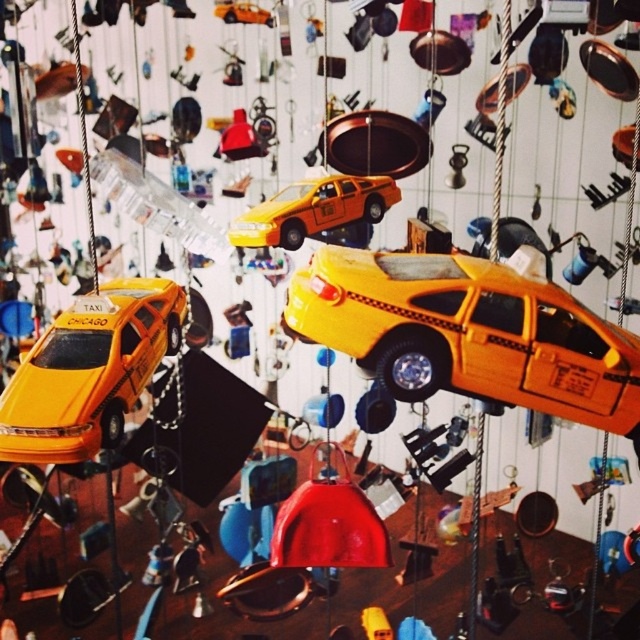
Question: Can you confirm if yellow matte taxi at center is smaller than matte yellow toy car at left?

Choices:
 (A) no
 (B) yes

Answer: (B)

Question: Can you confirm if matte yellow toy car at left is bigger than matte yellow toy car at center?

Choices:
 (A) yes
 (B) no

Answer: (A)

Question: Does yellow matte taxi at center have a larger size compared to matte yellow toy car at left?

Choices:
 (A) yes
 (B) no

Answer: (B)

Question: Which object is positioned closest to the matte yellow toy car at left?

Choices:
 (A) yellow matte taxi at center
 (B) matte yellow toy car at center

Answer: (B)

Question: Considering the real-world distances, which object is farthest from the yellow matte taxi at center?

Choices:
 (A) matte yellow toy car at center
 (B) matte yellow toy car at left

Answer: (A)

Question: Which of these objects is positioned closest to the yellow matte taxi at center?

Choices:
 (A) matte yellow toy car at left
 (B) matte yellow toy car at center

Answer: (A)